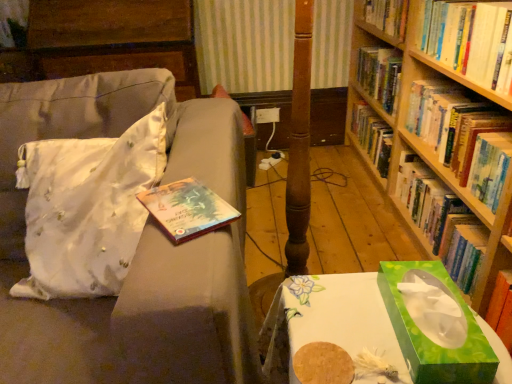
Find the location of a particular element. The width and height of the screenshot is (512, 384). free space above white glossy table at lower right (from a real-world perspective) is located at coordinates (346, 314).